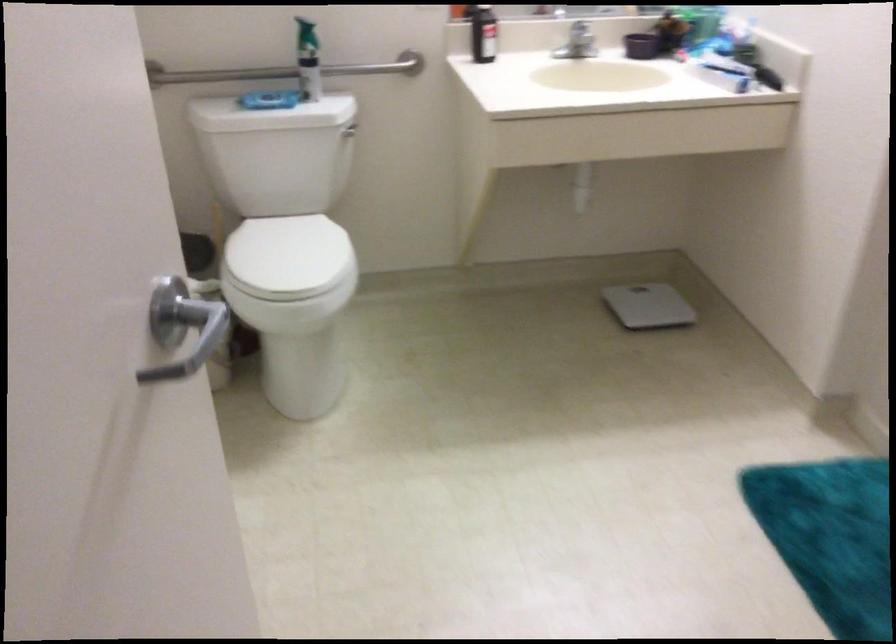
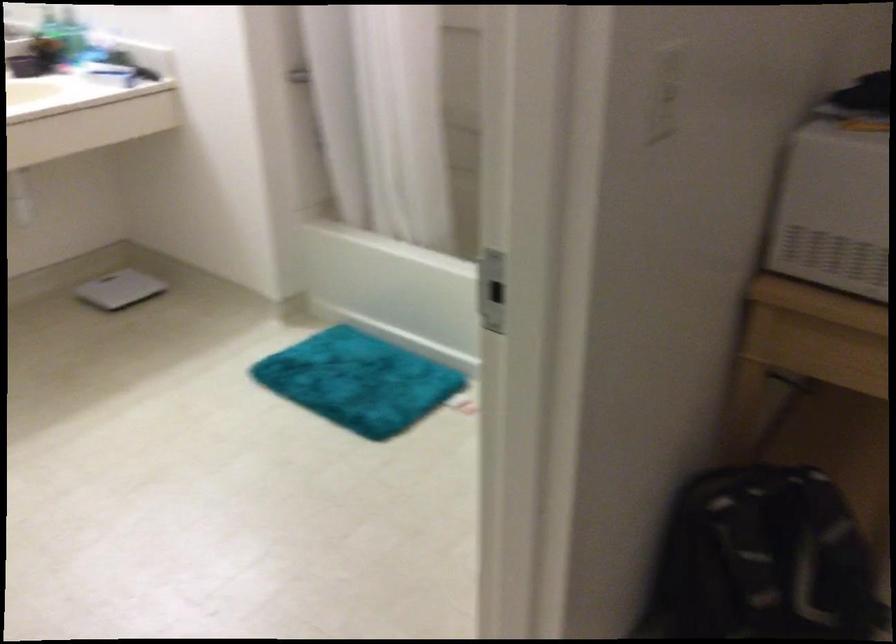
Locate, in the second image, the point that corresponds to pixel 649 303 in the first image.

(119, 289)